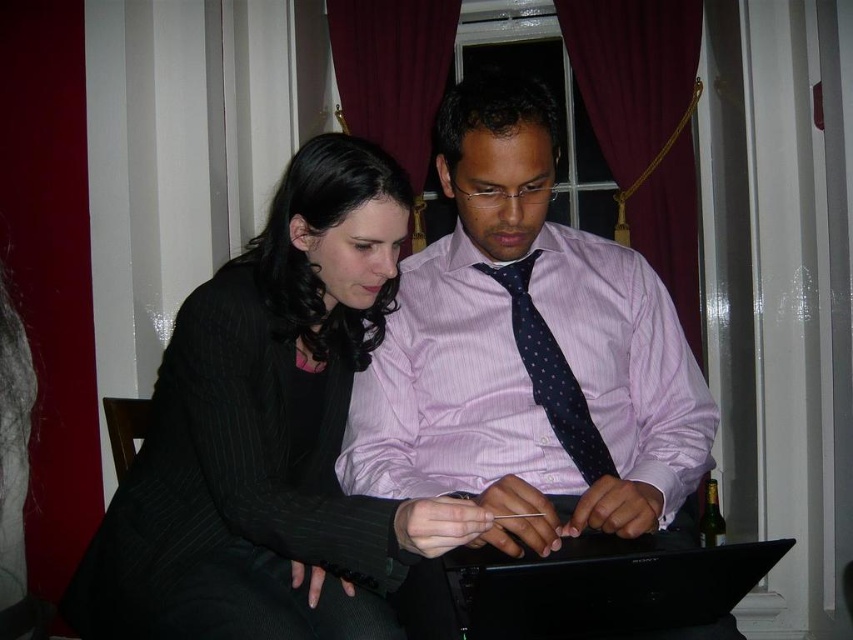
You are a delivery person who needs to place a package between the pink striped dress shirt at center and the black matte laptop at center. The package is 25 centimeters long. Can you fit it there?

The distance between the pink striped dress shirt at center and the black matte laptop at center is 23.70 centimeters. Since the package is 25 centimeters long, it is slightly longer than the available space. Therefore, the package cannot fit between them.

You are a delivery person who needs to determine if the black matte laptop at center can fit into a box that is the same height as the dark blue dotted tie at center. Can it fit?

The black matte laptop at center is not as tall as dark blue dotted tie at center, so it can fit into the box since the box is the same height as the tie, which is taller than the laptop.

Based on the photo, you are a photographer taking a portrait of the black pinstripe suit at center and the dark blue dotted tie at center. Which object should you focus on first if you want to ensure both are in focus, considering their sizes?

The black pinstripe suit at center is taller than the dark blue dotted tie at center, so focusing on the black pinstripe suit at center first would ensure both are in focus since it is larger in the frame.